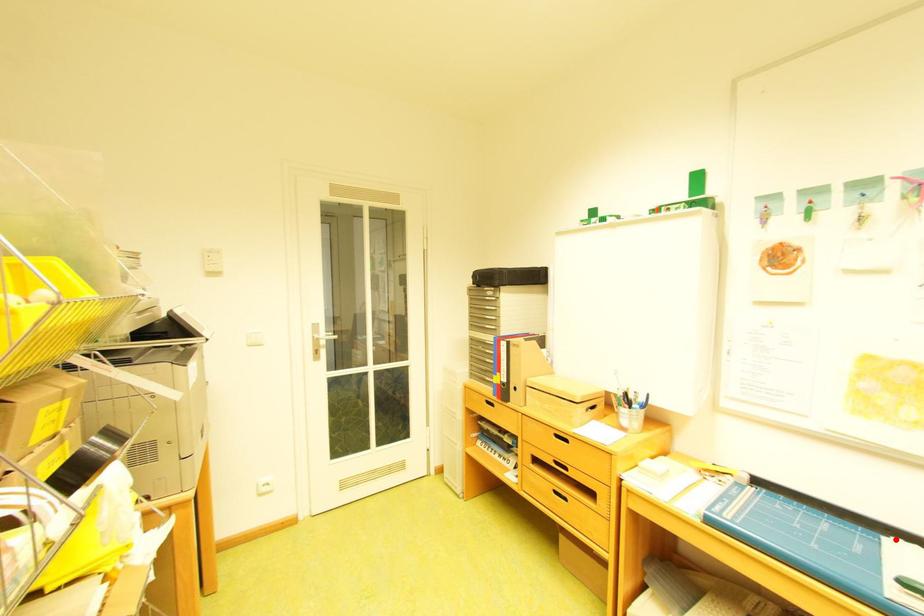
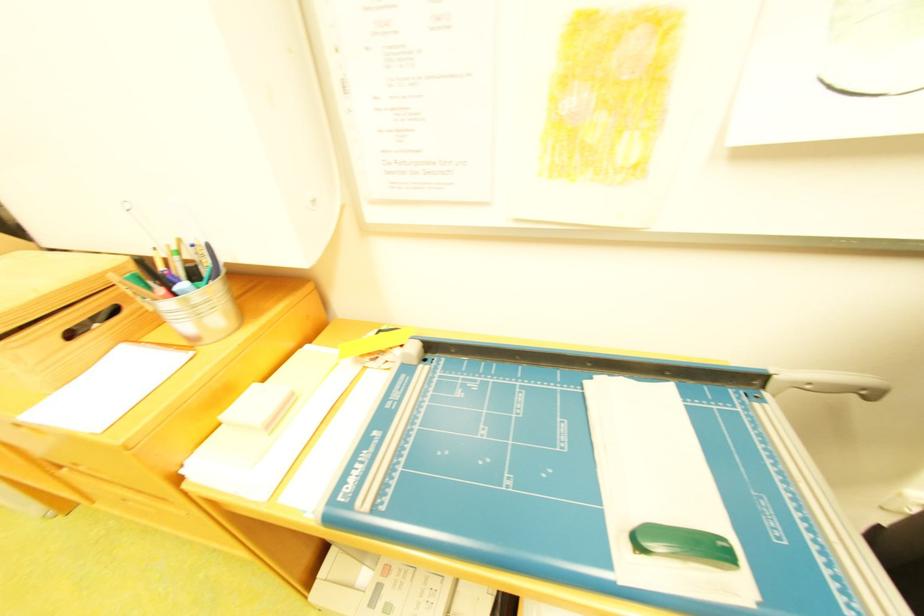
Question: A red point is marked in image1. In image2, is the corresponding 3D point closer to the camera or farther? Reply with the corresponding letter.

Choices:
 (A) The corresponding 3D point is closer.
 (B) The corresponding 3D point is farther.

Answer: (B)